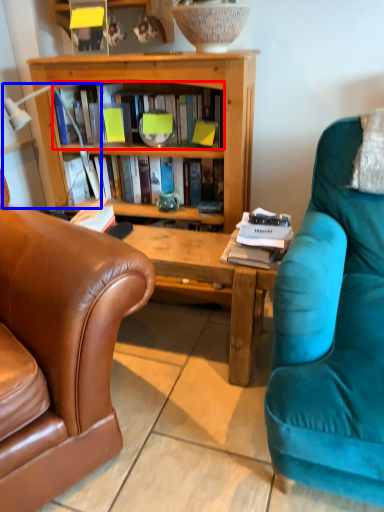
Question: Which object appears closest to the camera in this image, book (highlighted by a red box) or lamp (highlighted by a blue box)?

Choices:
 (A) book
 (B) lamp

Answer: (B)